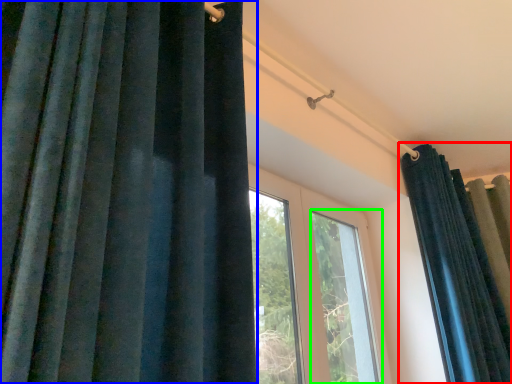
Question: Estimate the real-world distances between objects in this image. Which object is closer to curtain (highlighted by a red box), curtain (highlighted by a blue box) or window (highlighted by a green box)?

Choices:
 (A) curtain
 (B) window

Answer: (B)